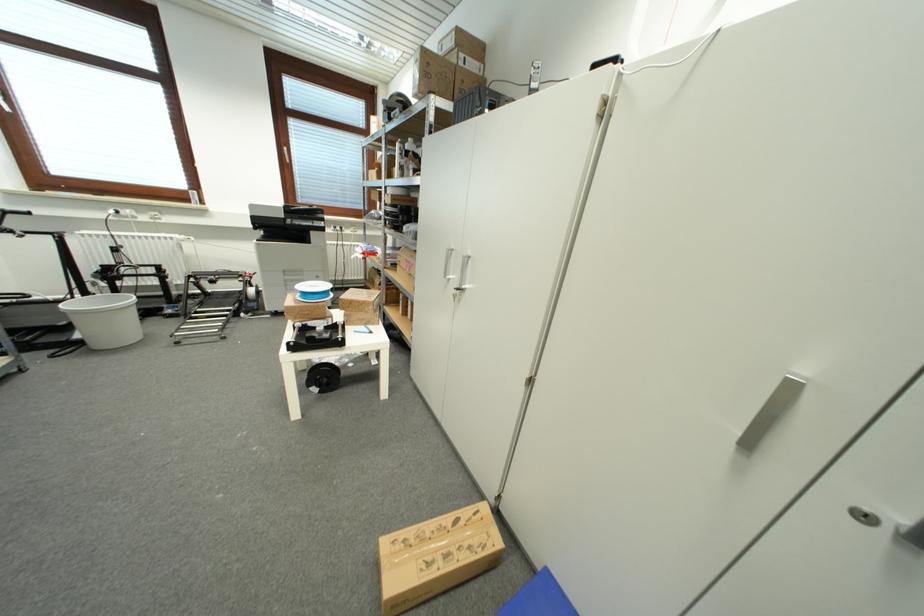
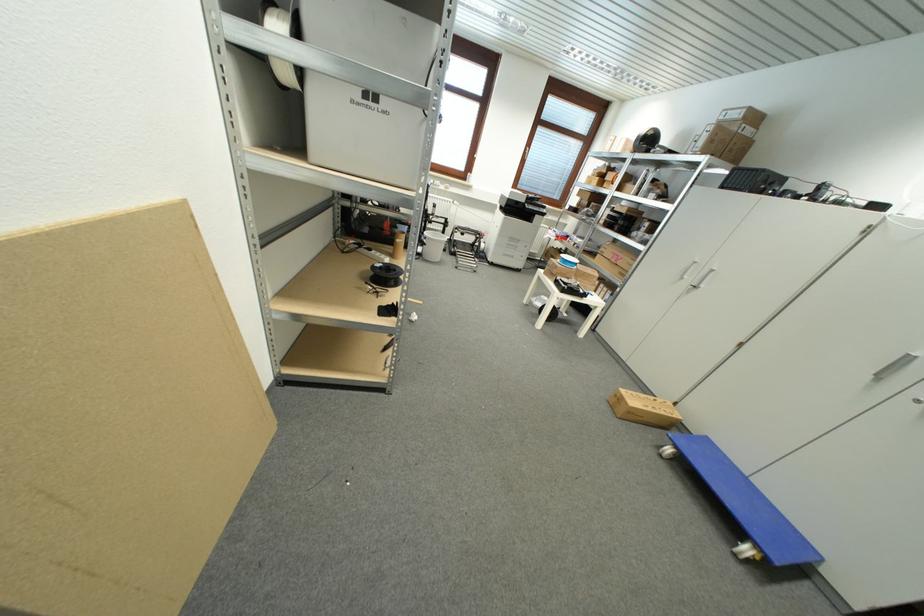
Find the pixel in the second image that matches the point at 796,391 in the first image.

(913, 361)